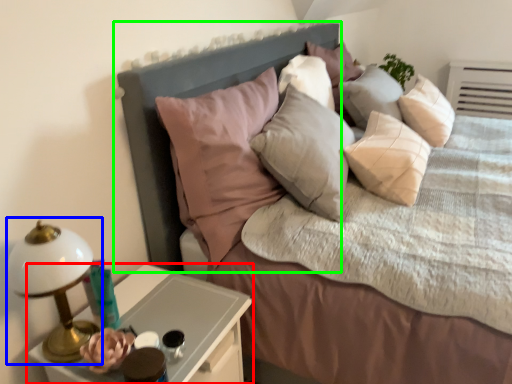
Question: Which is farther away from nightstand (highlighted by a red box)? bedside lamp (highlighted by a blue box) or headboard (highlighted by a green box)?

Choices:
 (A) bedside lamp
 (B) headboard

Answer: (B)